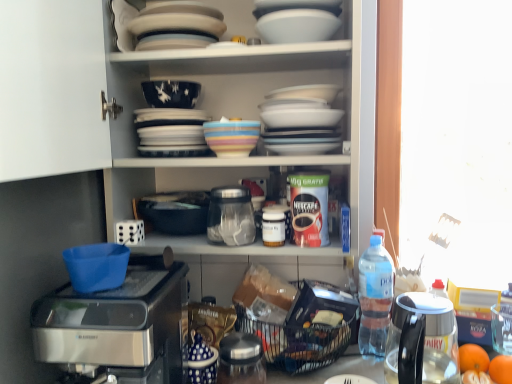
Question: Do you think white glossy bowl at lower center, the third tableware in the top-to-bottom sequence, is within orange matte at lower right, arranged as the 2th tangerine when viewed from the front, or outside of it?

Choices:
 (A) inside
 (B) outside

Answer: (B)

Question: Relative to orange matte at lower right, the first tangerine positioned from the back, is white glossy bowl at lower center, the third tableware in the top-to-bottom sequence, in front or behind?

Choices:
 (A) behind
 (B) front

Answer: (B)

Question: Which object is the closest to the black plastic basket at lower center?

Choices:
 (A) sleek metallic coffee maker at lower left
 (B) multicolored ceramic bowl at upper center, which is counted as the second tableware, starting from the top
 (C) dark blue glossy bowl at upper center
 (D) transparent glass jar at center, the second appliance viewed from the top
 (E) white glossy cabinet at upper center

Answer: (D)

Question: Which of these objects is positioned closest to the white glossy cabinet at upper center?

Choices:
 (A) orange matte at lower right, marked as the 2th tangerine in a back-to-front arrangement
 (B) clear plastic bottle at right, positioned as the second bottle in top-to-bottom order
 (C) white plastic container at center, arranged as the 1th bottle when viewed from the front
 (D) dark blue glossy bowl at upper center
 (E) porcelain plates at upper center, the third appliance when ordered from bottom to top

Answer: (D)